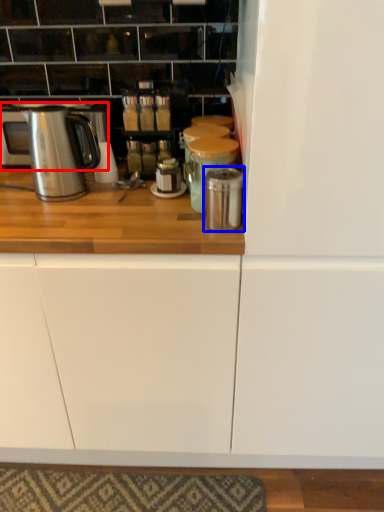
Question: Which object is further to the camera taking this photo, home appliance (highlighted by a red box) or appliance (highlighted by a blue box)?

Choices:
 (A) home appliance
 (B) appliance

Answer: (A)